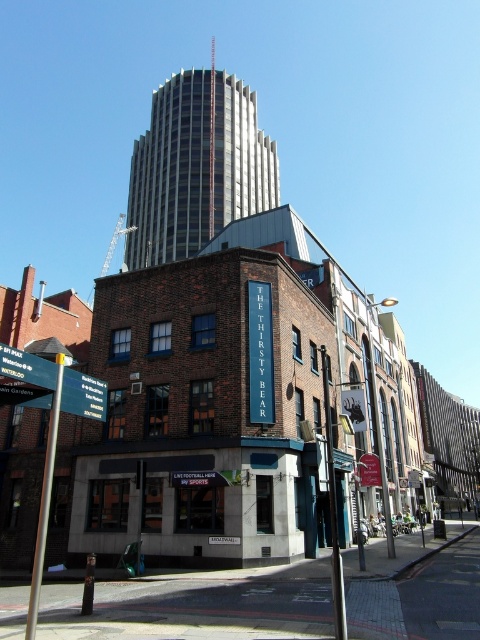
Between point (240, 163) and point (79, 376), which one is positioned behind?

The point (240, 163) is more distant.

Does point (165, 99) come behind point (92, 410)?

Yes, it is.

Measure the distance between point (172,177) and camera.

They are 104.75 meters apart.

Where is `gray concrete skyscraper at center`? This screenshot has height=640, width=480. gray concrete skyscraper at center is located at coordinates 196,166.